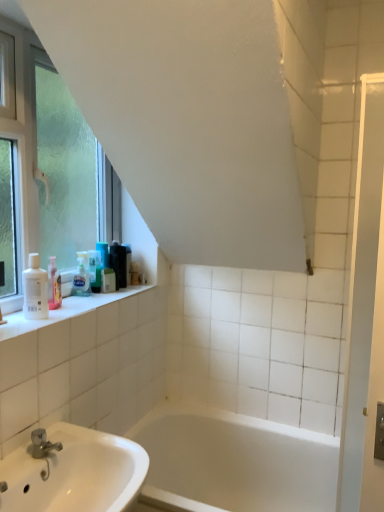
Question: Considering the relative positions of translucent plastic bottles at upper left, the fifth toiletry when ordered from front to back, and white matte lotion at left, which is the 1th toiletry from front to back, in the image provided, is translucent plastic bottles at upper left, the fifth toiletry when ordered from front to back, to the right of white matte lotion at left, which is the 1th toiletry from front to back, from the viewer's perspective?

Choices:
 (A) no
 (B) yes

Answer: (B)

Question: Does translucent plastic bottles at upper left, the fifth toiletry when ordered from front to back, have a greater width compared to white matte lotion at left, acting as the sixth toiletry starting from the back?

Choices:
 (A) yes
 (B) no

Answer: (B)

Question: Could you tell me if translucent plastic bottles at upper left, the second toiletry viewed from the back, is turned towards white matte lotion at left, acting as the sixth toiletry starting from the back?

Choices:
 (A) yes
 (B) no

Answer: (B)

Question: Is translucent plastic bottles at upper left, the second toiletry viewed from the back, not near white matte lotion at left, which is the 1th toiletry from front to back?

Choices:
 (A) yes
 (B) no

Answer: (B)

Question: Would you say white matte lotion at left, which is the 1th toiletry from front to back, is part of translucent plastic bottles at upper left, the second toiletry viewed from the back,'s contents?

Choices:
 (A) yes
 (B) no

Answer: (B)

Question: Does translucent plastic bottles at upper left, the fifth toiletry when ordered from front to back, have a larger size compared to white matte lotion at left, acting as the sixth toiletry starting from the back?

Choices:
 (A) yes
 (B) no

Answer: (B)

Question: Can we say white glossy bathtub at center lies outside white glossy screen door at right?

Choices:
 (A) yes
 (B) no

Answer: (A)

Question: Considering the relative sizes of white glossy bathtub at center and white glossy screen door at right in the image provided, is white glossy bathtub at center shorter than white glossy screen door at right?

Choices:
 (A) no
 (B) yes

Answer: (B)

Question: From a real-world perspective, does white glossy bathtub at center sit lower than white glossy screen door at right?

Choices:
 (A) yes
 (B) no

Answer: (A)

Question: From a real-world perspective, is white glossy bathtub at center on white glossy screen door at right?

Choices:
 (A) no
 (B) yes

Answer: (A)

Question: Is white glossy bathtub at center directly adjacent to white glossy screen door at right?

Choices:
 (A) yes
 (B) no

Answer: (B)

Question: Considering the relative sizes of white glossy bathtub at center and white glossy screen door at right in the image provided, is white glossy bathtub at center bigger than white glossy screen door at right?

Choices:
 (A) yes
 (B) no

Answer: (A)

Question: Is the surface of black plastic container at upper left, the first toiletry positioned from the back, in direct contact with frosted glass window at left?

Choices:
 (A) no
 (B) yes

Answer: (A)